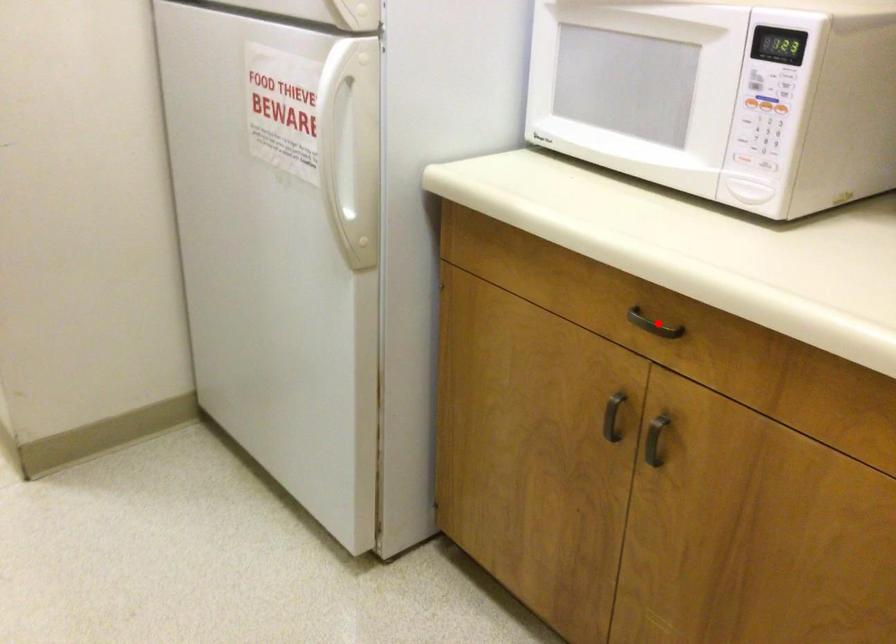
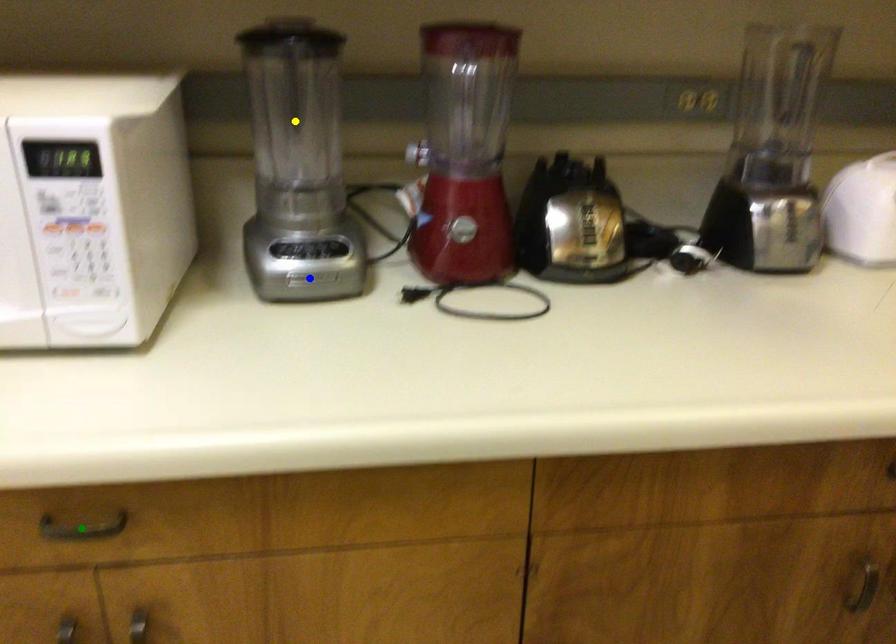
Question: I am providing you with two images of the same scene from different viewpoints. A red point is marked on the first image. You are given multiple points on the second image. Which point in image 2 is actually the same real-world point as the red point in image 1?

Choices:
 (A) green point
 (B) yellow point
 (C) blue point

Answer: (A)